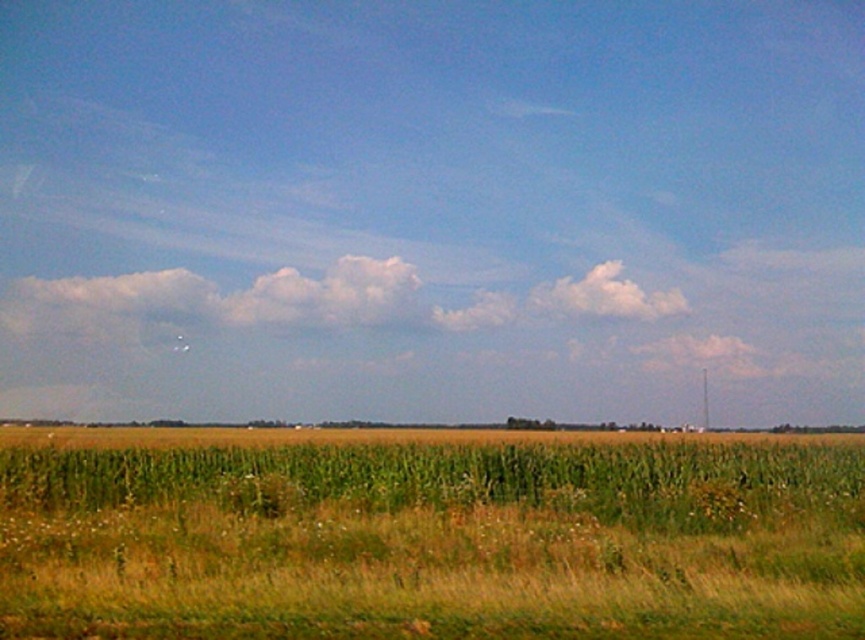
Question: Can you confirm if green grassy wheat field at center is smaller than white fluffy cloud at center?

Choices:
 (A) no
 (B) yes

Answer: (A)

Question: Estimate the real-world distances between objects in this image. Which object is closer to the white fluffy cloud at center?

Choices:
 (A) white fluffy cloud at upper center
 (B) green grassy wheat field at center

Answer: (A)

Question: In this image, where is green grassy wheat field at center located relative to white fluffy cloud at center?

Choices:
 (A) below
 (B) above

Answer: (A)

Question: Is green grassy wheat field at center below white fluffy cloud at upper center?

Choices:
 (A) yes
 (B) no

Answer: (A)

Question: Which object is closer to the camera taking this photo?

Choices:
 (A) white fluffy cloud at upper center
 (B) green grassy wheat field at center
 (C) white fluffy cloud at center

Answer: (B)

Question: Which of the following is the farthest from the observer?

Choices:
 (A) white fluffy cloud at center
 (B) green grassy wheat field at center
 (C) white fluffy cloud at upper center

Answer: (C)